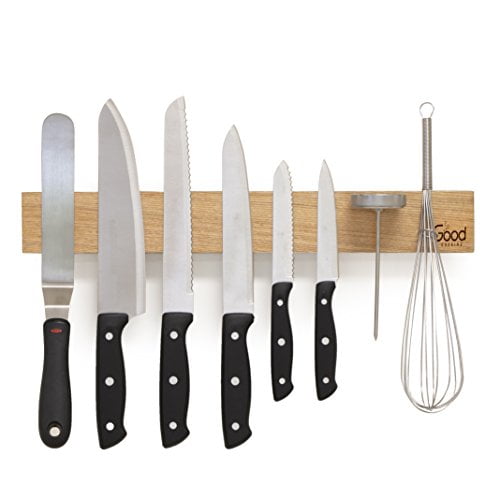
Find the location of a particular element. spatula handle is located at coordinates point(58,399).